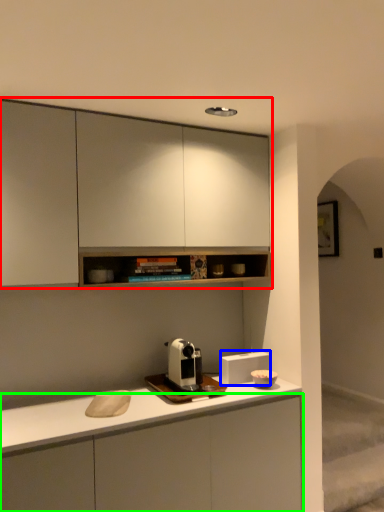
Question: Which object is the farthest from cabinetry (highlighted by a red box)? Choose among these: appliance (highlighted by a blue box) or cabinetry (highlighted by a green box).

Choices:
 (A) appliance
 (B) cabinetry

Answer: (B)